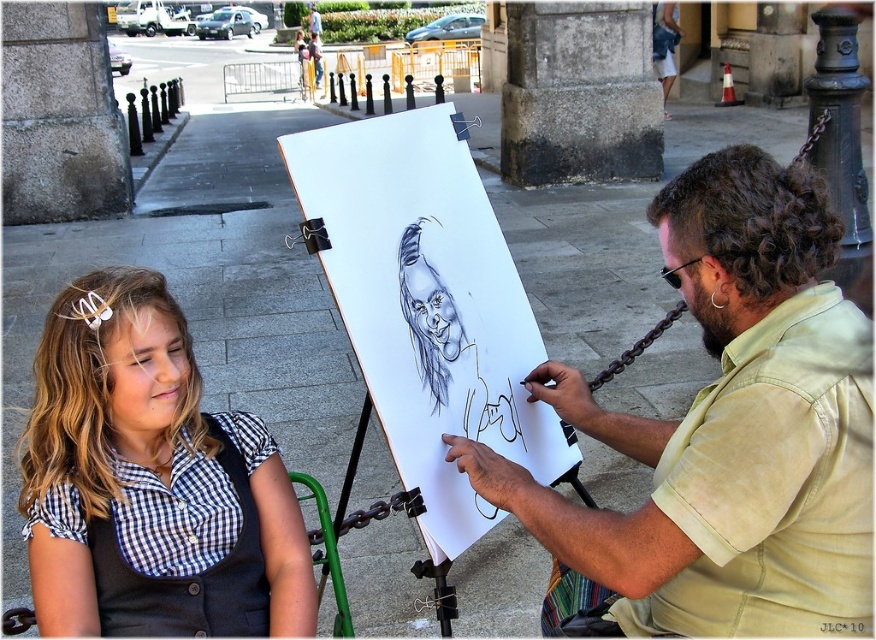
You are a fashion designer observing the artist and the girl in the image. You need to determine which clothing item is higher in position between the light beige shirt at center and the checkered fabric at lower left. Which one is higher?

The light beige shirt at center is taller than checkered fabric at lower left, so the light beige shirt at center is higher in position.

You are a photographer standing 6 feet away from the light beige shirt at center. Can you capture the entire shirt in your camera frame without moving closer?

The light beige shirt at center is 5.02 feet away from the camera. Since you are standing 6 feet away, you are slightly farther than the shirt, so you might need to move closer or use a wider lens to ensure the entire shirt fits in the frame.

You are a tailor observing the scene. You need to determine which item has a larger width between the light beige shirt at center and the checkered fabric at lower left without measuring tools. Based on the scene, which one is wider?

The light beige shirt at center is wider than the checkered fabric at lower left according to the description.